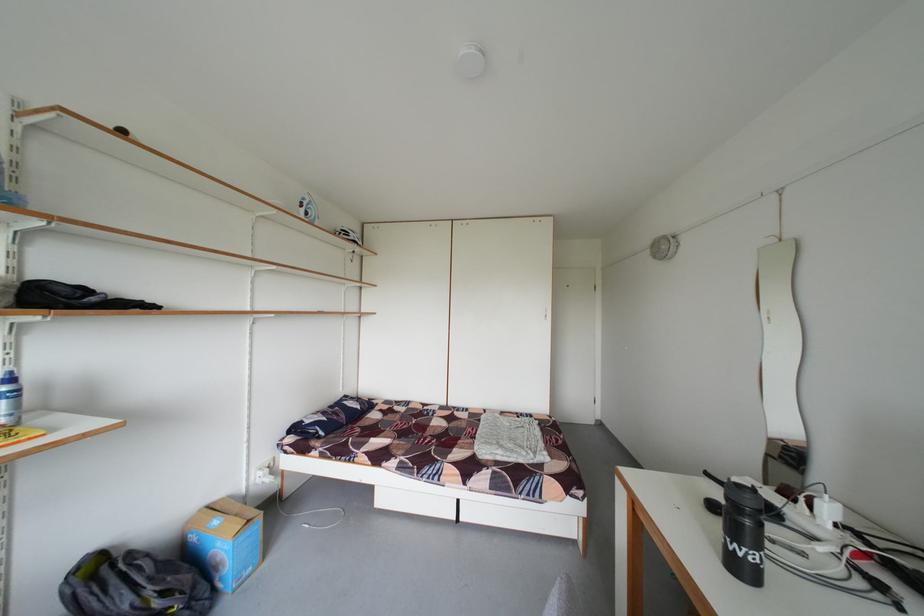
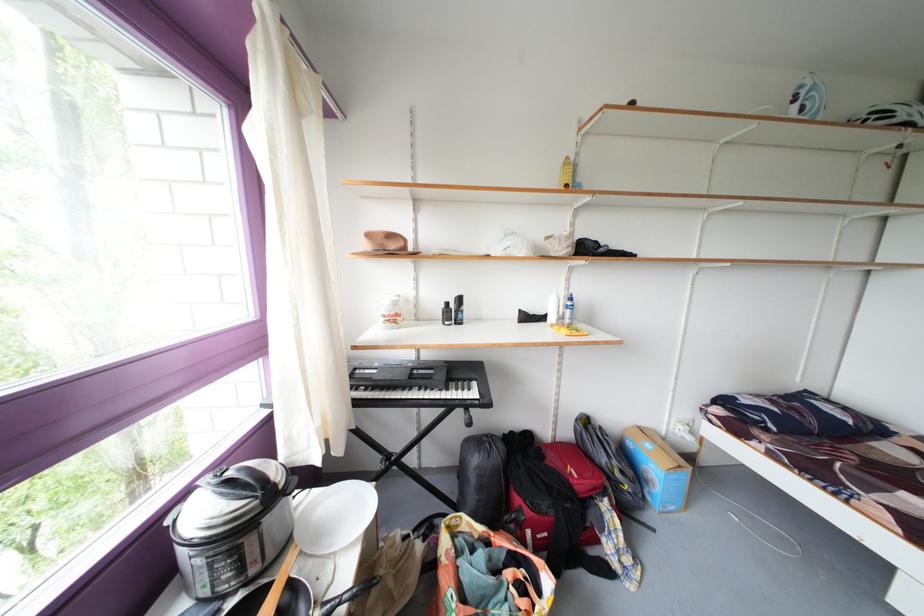
Question: The camera is either moving clockwise (left) or counter-clockwise (right) around the object. The first image is from the beginning of the video and the second image is from the end. Is the camera moving left or right when shooting the video?

Choices:
 (A) Left
 (B) Right

Answer: (B)